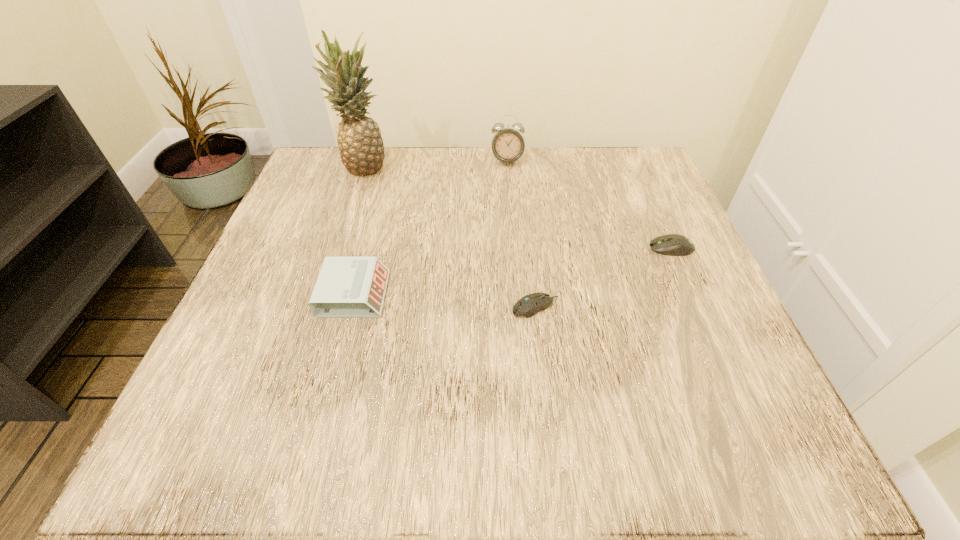
This screenshot has height=540, width=960. What are the coordinates of `pineapple` in the screenshot? It's located at (361, 148).

The height and width of the screenshot is (540, 960). I want to click on the right alarm clock, so click(507, 144).

This screenshot has height=540, width=960. In order to click on the farther alarm clock in this screenshot , I will do `click(507, 144)`.

Where is `the nearer alarm clock`? This screenshot has height=540, width=960. the nearer alarm clock is located at coordinates (347, 287).

Image resolution: width=960 pixels, height=540 pixels. What are the coordinates of `the shorter alarm clock` in the screenshot? It's located at (347, 287).

Locate an element on the screen. The image size is (960, 540). the farther computer mouse is located at coordinates (672, 244).

The image size is (960, 540). I want to click on the right computer mouse, so click(672, 244).

Identify the location of the shortest object. The width and height of the screenshot is (960, 540). (529, 305).

Identify the location of the nearer computer mouse. 529,305.

Locate an element on the screen. vacant area situated on the right of the pineapple is located at coordinates (475, 167).